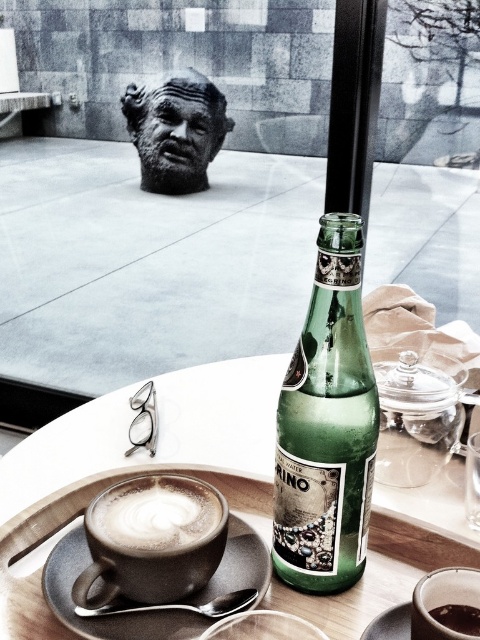
Please look at the point marked at coordinates (326, 426). What object is located there?

The point at coordinates (326, 426) indicates the green glass bottle at center.

From the picture: You are a barista setting up a table for a customer. You have a matte white tray at center and a black stone bust at upper center. Which object should you place a small note on to ensure it is visible from above?

The black stone bust at upper center is taller than the matte white tray at center, so placing the note on the black stone bust at upper center would make it more visible from above.

You are a delivery person who needs to place a package on the table without touching the black stone bust at upper center. The package is 1.6 meters long. Can you fit it on the table?

The black stone bust at upper center and viewer are 1.57 meters apart from each other. Since the package is 1.6 meters long, it is slightly longer than the available space between the bust and the viewer, so it might not fit without touching the bust.